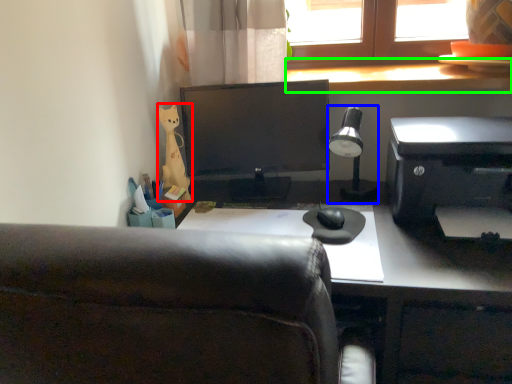
Question: Which is farther away from stationery (highlighted by a red box)? lamp (highlighted by a blue box) or window sill (highlighted by a green box)?

Choices:
 (A) lamp
 (B) window sill

Answer: (B)